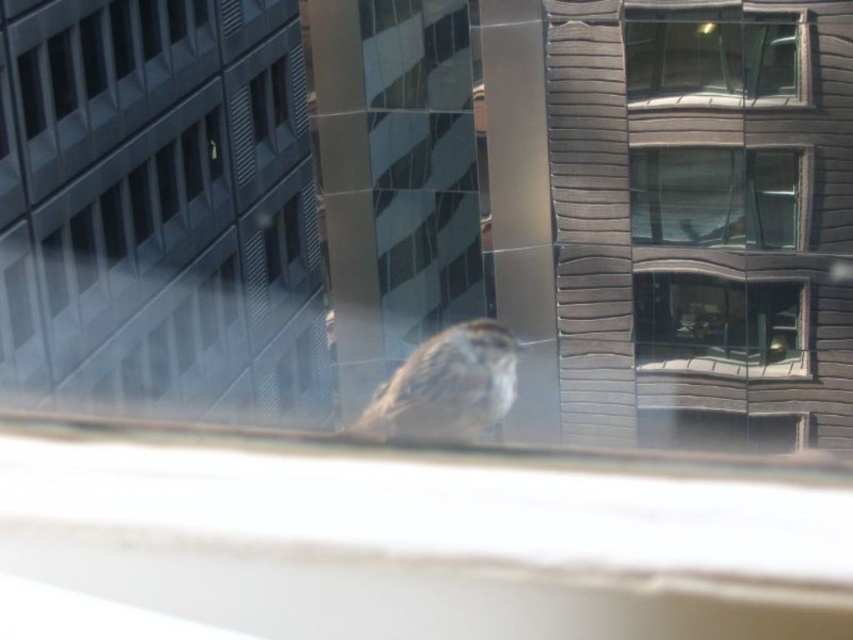
Question: Does transparent glass window at center appear on the left side of clear glass window at center?

Choices:
 (A) yes
 (B) no

Answer: (A)

Question: Which object appears closest to the camera in this image?

Choices:
 (A) clear glass window at upper center
 (B) clear glass window at center

Answer: (A)

Question: Which object is the farthest from the clear glass window at center?

Choices:
 (A) clear glass window at upper center
 (B) brown speckled sparrow at center
 (C) transparent glass window at center

Answer: (B)

Question: Which point is closer to the camera taking this photo?

Choices:
 (A) (712, 65)
 (B) (456, 387)

Answer: (B)

Question: Does transparent glass window at center lie in front of clear glass window at center?

Choices:
 (A) no
 (B) yes

Answer: (B)

Question: Is clear glass window at upper center wider than transparent glass window at center?

Choices:
 (A) yes
 (B) no

Answer: (A)